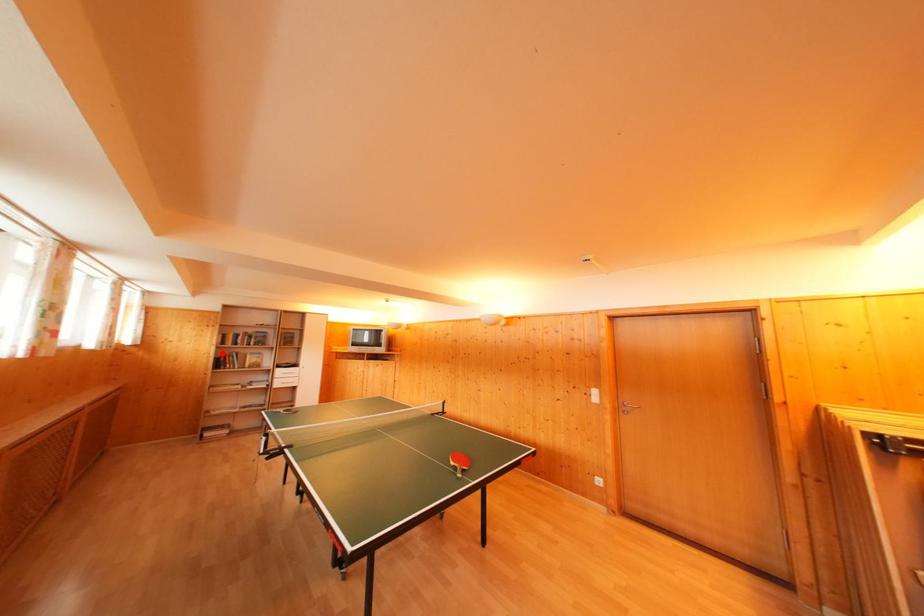
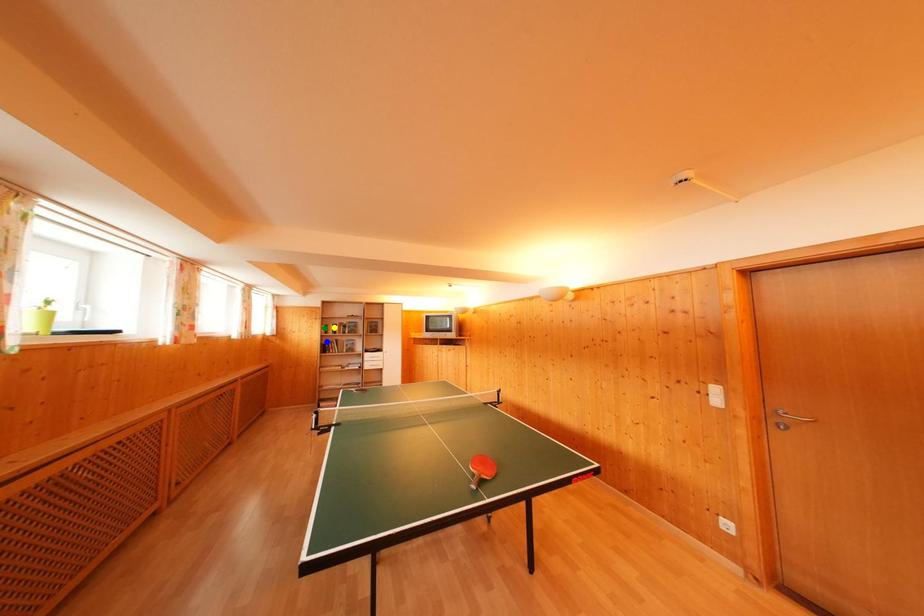
Question: I am providing you with two images of the same scene from different viewpoints. A red point is marked on the first image. You are given multiple points on the second image. Which point in image 2 represents the same 3d spot as the red point in image 1?

Choices:
 (A) green point
 (B) blue point
 (C) yellow point

Answer: (B)